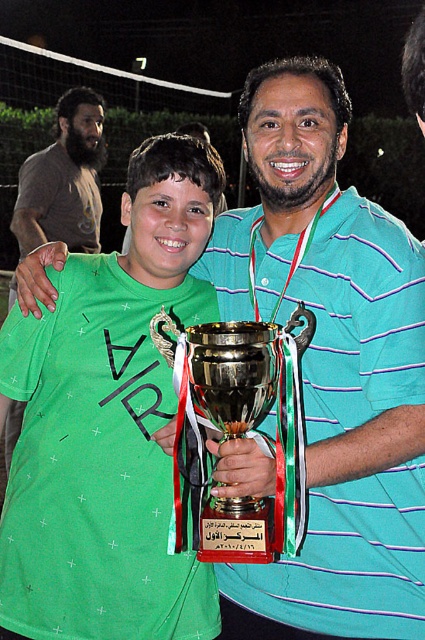
Question: Can you confirm if gold metallic trophy at center is bigger than dark brown t-shirt at left?

Choices:
 (A) no
 (B) yes

Answer: (A)

Question: Based on their relative distances, which object is nearer to the green matte shirt at center?

Choices:
 (A) gold metallic trophy at center
 (B) dark brown t-shirt at left

Answer: (A)

Question: Can you confirm if green matte shirt at center is bigger than gold metallic trophy at center?

Choices:
 (A) yes
 (B) no

Answer: (A)

Question: Which of the following is the farthest from the observer?

Choices:
 (A) green matte shirt at center
 (B) gold metallic trophy at center
 (C) dark brown t-shirt at left

Answer: (C)

Question: Which of the following is the farthest from the observer?

Choices:
 (A) dark brown t-shirt at left
 (B) green matte shirt at center
 (C) gold metallic trophy at center

Answer: (A)

Question: Considering the relative positions of gold metallic trophy at center and dark brown t-shirt at left in the image provided, where is gold metallic trophy at center located with respect to dark brown t-shirt at left?

Choices:
 (A) below
 (B) above

Answer: (A)